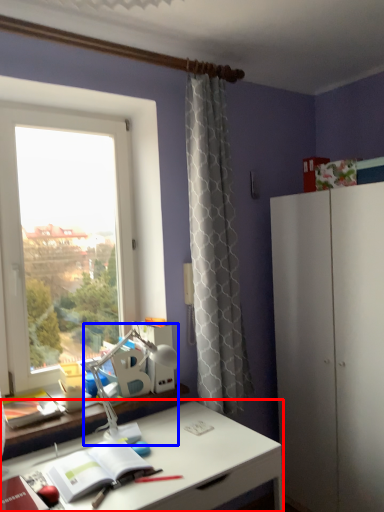
Question: Which of the following is the closest to the observer, desk (highlighted by a red box) or table lamp (highlighted by a blue box)?

Choices:
 (A) desk
 (B) table lamp

Answer: (A)